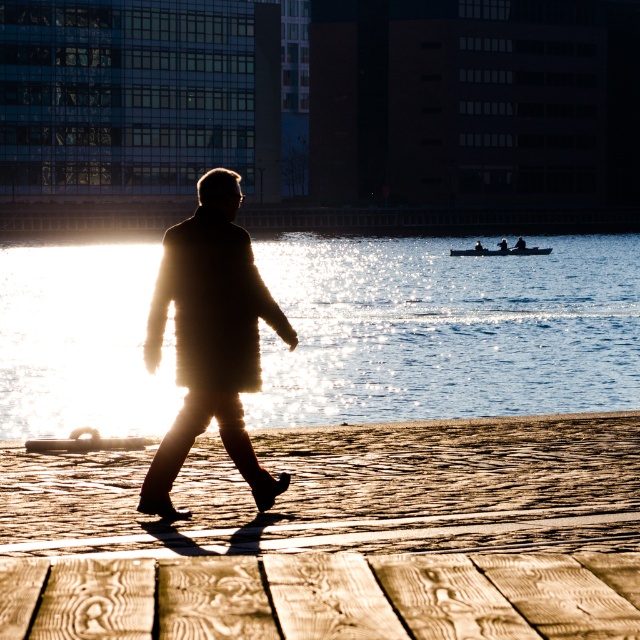
Who is higher up, glistening water at center or smooth black boat at center?

smooth black boat at center

Does glistening water at center have a larger size compared to smooth black boat at center?

Correct, glistening water at center is larger in size than smooth black boat at center.

Is point (4, 412) closer to viewer compared to point (476, 248)?

Yes, point (4, 412) is in front of point (476, 248).

This screenshot has height=640, width=640. In order to click on glistening water at center in this screenshot , I will do `click(445, 330)`.

Consider the image. Is wooden planks at lower center below silhouette wool coat at center?

Yes.

Based on the photo, is wooden planks at lower center above silhouette wool coat at center?

No.

What do you see at coordinates (323, 596) in the screenshot? This screenshot has width=640, height=640. I see `wooden planks at lower center` at bounding box center [323, 596].

Locate an element on the screen. wooden planks at lower center is located at coordinates (323, 596).

Between wooden planks at lower center and smooth black boat at center, which one has more height?

Standing taller between the two is smooth black boat at center.

Is wooden planks at lower center to the left of smooth black boat at center from the viewer's perspective?

Correct, you'll find wooden planks at lower center to the left of smooth black boat at center.

Locate an element on the screen. wooden planks at lower center is located at coordinates (323, 596).

In order to click on wooden planks at lower center in this screenshot , I will do `click(323, 596)`.